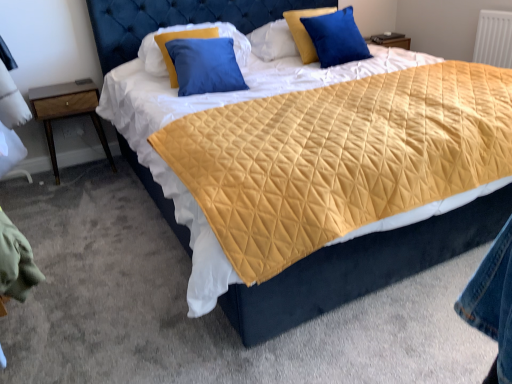
Where is `vacant area situated below wooden nightstand at left (from a real-world perspective)`? vacant area situated below wooden nightstand at left (from a real-world perspective) is located at coordinates (86, 162).